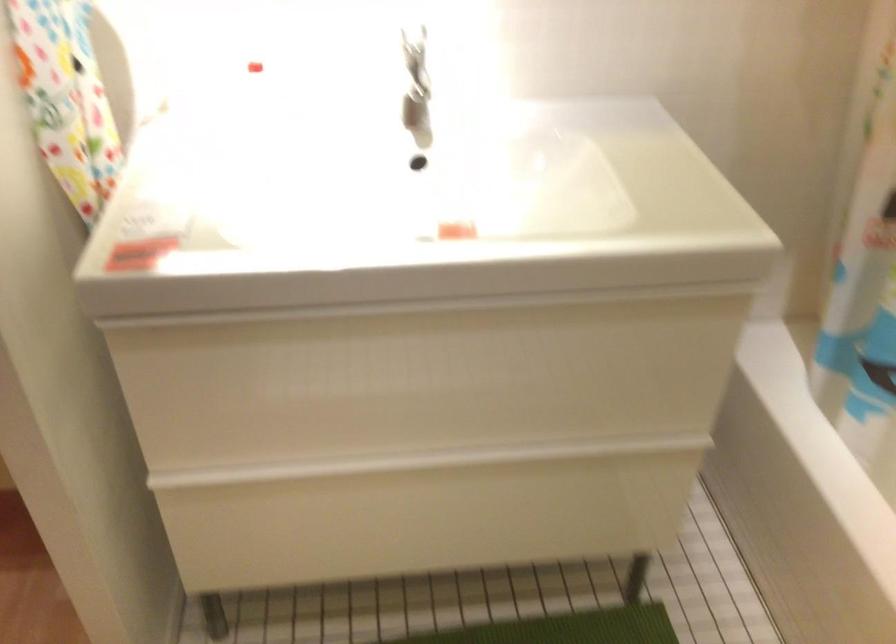
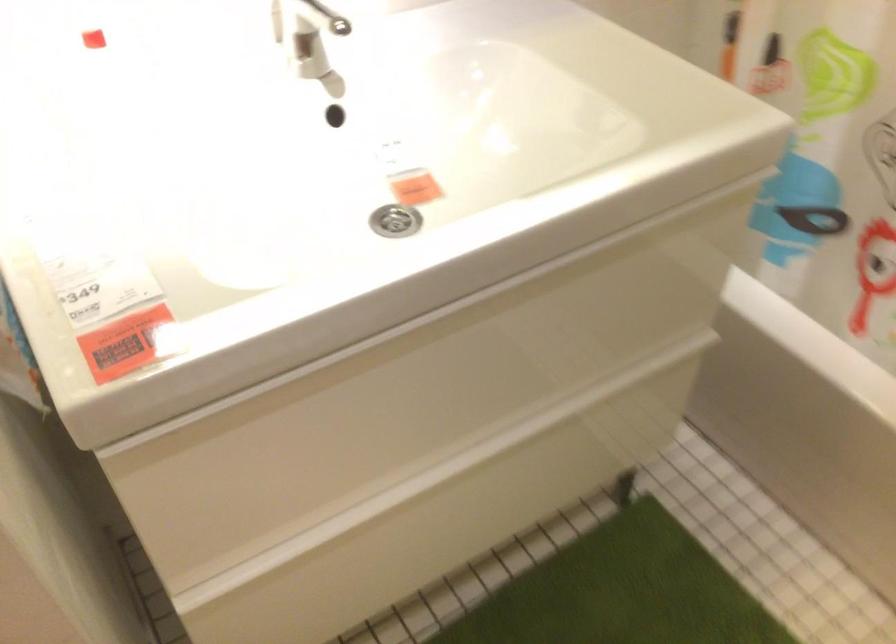
In the second image, find the point that corresponds to point 376,379 in the first image.

(423, 392)